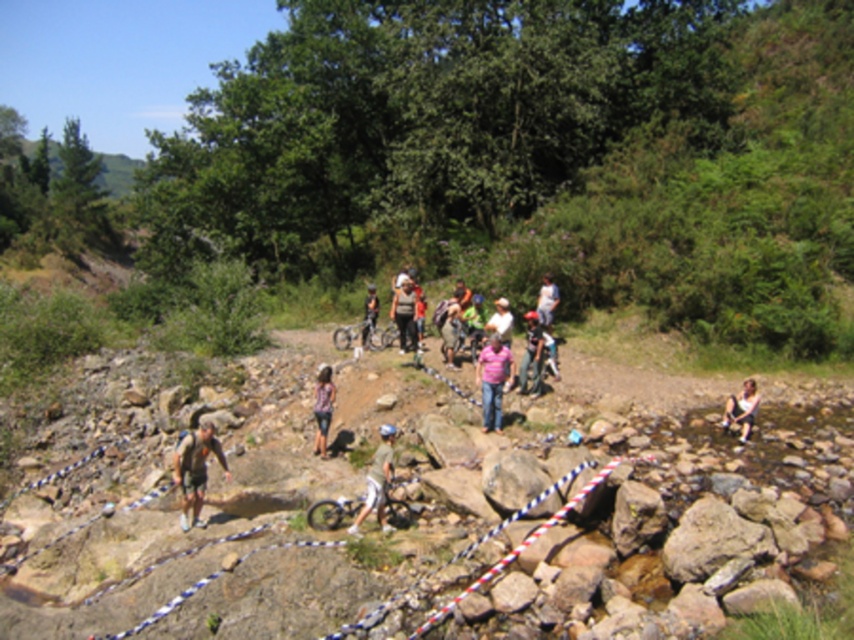
Does white fabric shirt at lower right have a lesser width compared to light blue denim jeans at center?

Yes, white fabric shirt at lower right is thinner than light blue denim jeans at center.

This screenshot has width=854, height=640. What do you see at coordinates (741, 408) in the screenshot? I see `white fabric shirt at lower right` at bounding box center [741, 408].

Identify the location of white fabric shirt at lower right. This screenshot has width=854, height=640. (741, 408).

Can you confirm if metallic silver mountain bike at center is bigger than white matte shirt at center?

Incorrect, metallic silver mountain bike at center is not larger than white matte shirt at center.

Measure the distance between metallic silver mountain bike at center and camera.

The distance of metallic silver mountain bike at center from camera is 34.16 feet.

Image resolution: width=854 pixels, height=640 pixels. I want to click on metallic silver mountain bike at center, so click(331, 512).

Does matte black mountain bike at center appear under light blue denim jeans at center?

Yes, matte black mountain bike at center is below light blue denim jeans at center.

Can you confirm if matte black mountain bike at center is positioned to the left of light blue denim jeans at center?

Yes, matte black mountain bike at center is to the left of light blue denim jeans at center.

Between point (384, 333) and point (545, 289), which one is positioned behind?

The point (384, 333) is more distant.

Where is `matte black mountain bike at center`? matte black mountain bike at center is located at coordinates (360, 333).